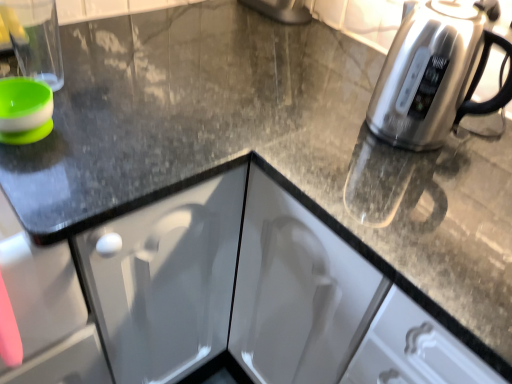
Identify the location of unoccupied space behind transparent plastic cup at upper left. The height and width of the screenshot is (384, 512). 86,37.